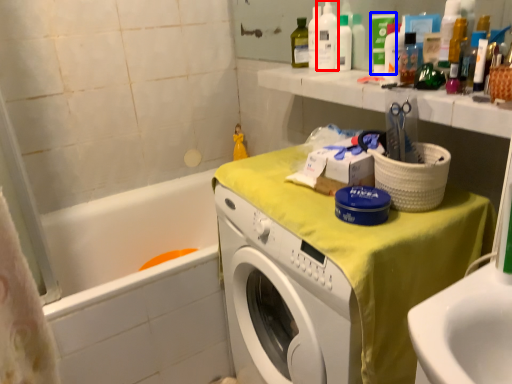
Question: Which object appears farthest to the camera in this image, cleaning product (highlighted by a red box) or toiletry (highlighted by a blue box)?

Choices:
 (A) cleaning product
 (B) toiletry

Answer: (A)